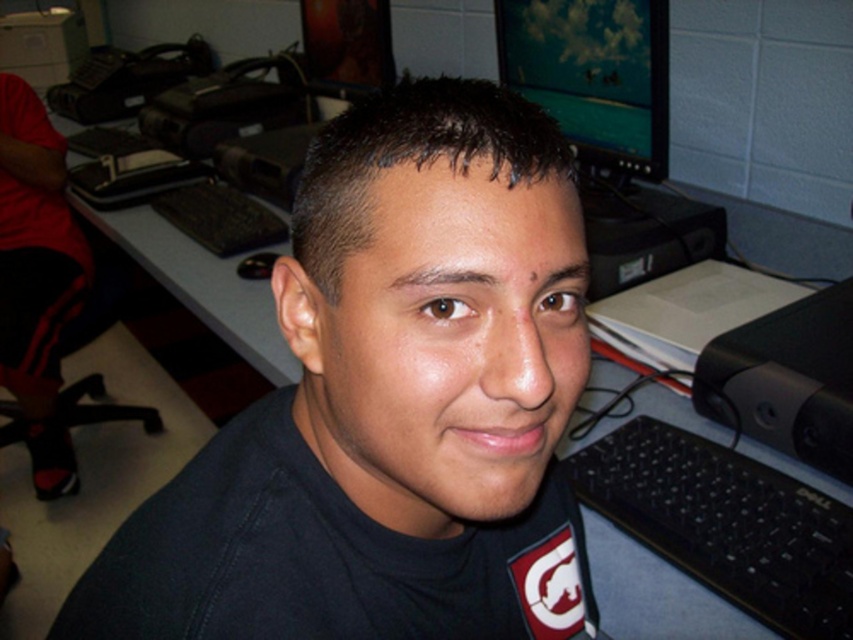
Question: Does black plastic keyboard at lower right appear on the right side of dark brown hair at center?

Choices:
 (A) yes
 (B) no

Answer: (A)

Question: Which of the following is the farthest from the observer?

Choices:
 (A) (844, 545)
 (B) (547, 342)
 (C) (444, 435)
 (D) (421, 168)

Answer: (A)

Question: Which is farther from the smooth skin head at center?

Choices:
 (A) brown matte eyebrow at upper left
 (B) shiny dark hair at center
 (C) black plastic keyboard at lower right

Answer: (C)

Question: Estimate the real-world distances between objects in this image. Which object is closer to the black matte shirt at center?

Choices:
 (A) black plastic keyboard at lower right
 (B) brown hair at upper center
 (C) brown matte eyebrow at upper left

Answer: (B)

Question: Is black matte shirt at center positioned before smooth skin head at center?

Choices:
 (A) no
 (B) yes

Answer: (B)

Question: Where is black plastic keyboard at lower right located in relation to dark brown hair at center in the image?

Choices:
 (A) left
 (B) right

Answer: (B)